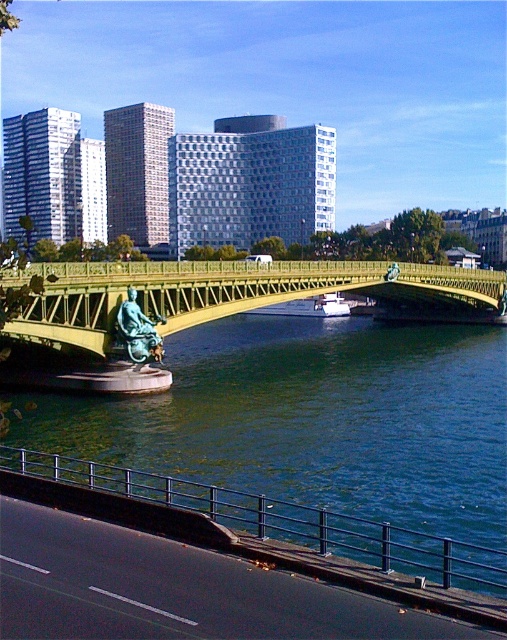
Question: Is greenish-blue water at center bigger than metallic gold bridge at center?

Choices:
 (A) yes
 (B) no

Answer: (B)

Question: Which object is farther from the camera taking this photo?

Choices:
 (A) bronze statue at center
 (B) greenish-blue water at center
 (C) white glossy boat at center

Answer: (C)

Question: Which point is closer to the camera taking this photo?

Choices:
 (A) (325, 298)
 (B) (241, 264)
 (C) (131, 355)

Answer: (C)

Question: Which object appears farthest from the camera in this image?

Choices:
 (A) white glossy boat at center
 (B) metallic gold bridge at center
 (C) greenish-blue water at center

Answer: (A)

Question: Does greenish-blue water at center have a lesser width compared to metallic gold bridge at center?

Choices:
 (A) yes
 (B) no

Answer: (A)

Question: Is greenish-blue water at center to the left of white glossy boat at center from the viewer's perspective?

Choices:
 (A) yes
 (B) no

Answer: (A)